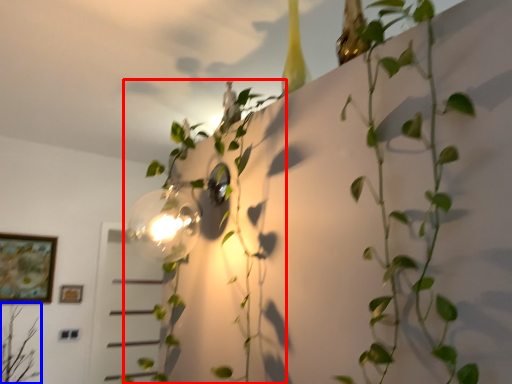
Question: Which point is closer to the camera, plant (highlighted by a red box) or plant (highlighted by a blue box)?

Choices:
 (A) plant
 (B) plant

Answer: (A)